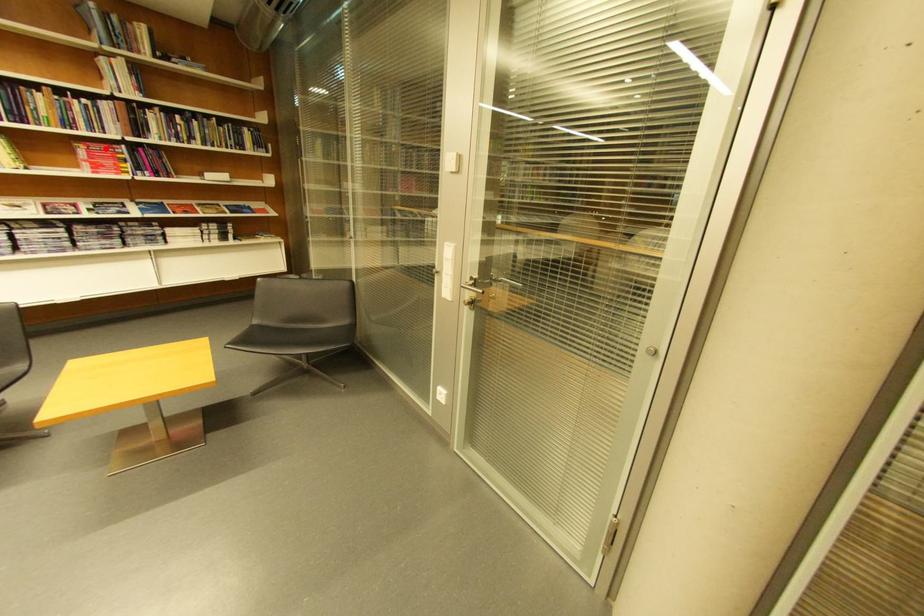
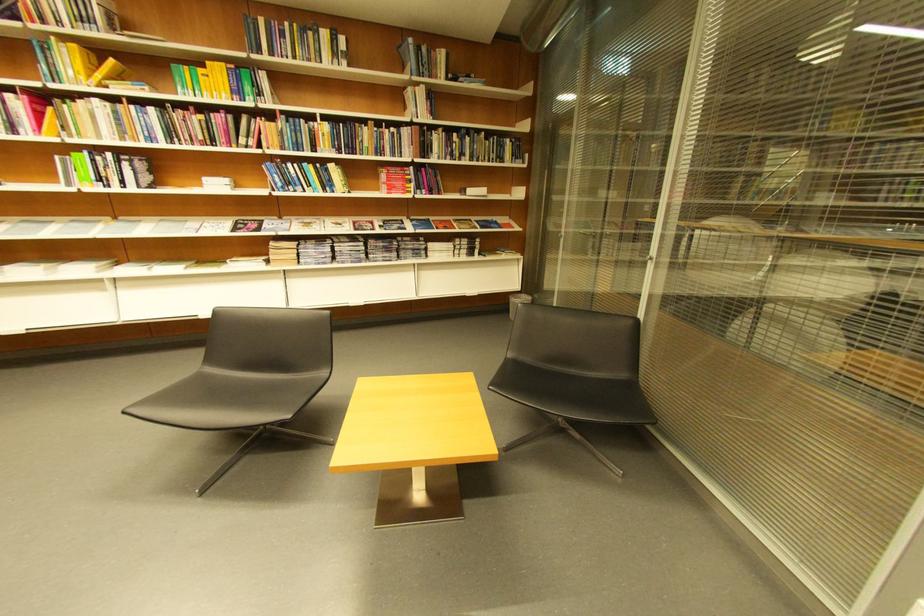
Question: I am providing you with two images of the same scene from different viewpoints. A red point is shown in image1. For the corresponding object point in image2, is it positioned nearer or farther from the camera?

Choices:
 (A) Nearer
 (B) Farther

Answer: (A)